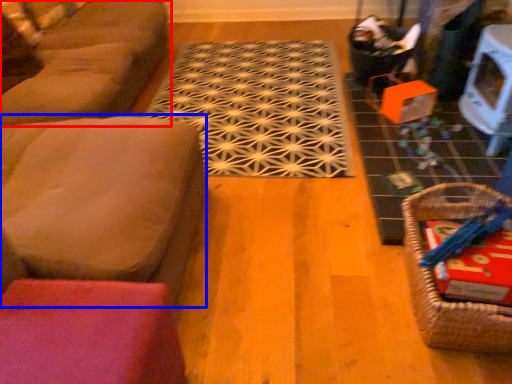
Question: Among these objects, which one is nearest to the camera, studio couch (highlighted by a red box) or couch (highlighted by a blue box)?

Choices:
 (A) studio couch
 (B) couch

Answer: (B)